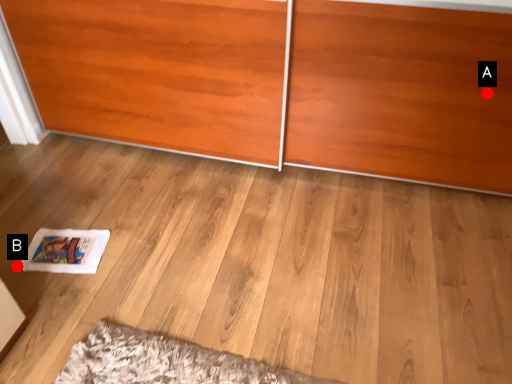
Question: Two points are circled on the image, labeled by A and B beside each circle. Which point is closer to the camera?

Choices:
 (A) A is closer
 (B) B is closer

Answer: (A)